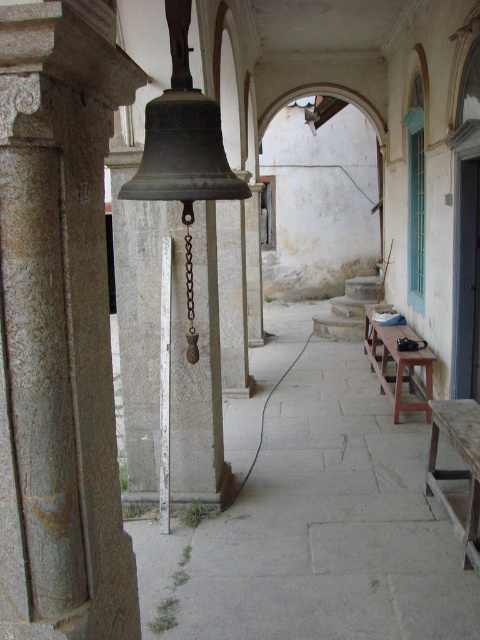
You are walking down the corridor and want to reach the end. There is a gray stone pillar at center and a smooth stone alley at center. Which one is closer to you as you walk forward?

The gray stone pillar at center is closer to you because it is in front of the smooth stone alley at center, meaning the alley is further back along the corridor.

You are planning to set up a temporary event in the corridor and need to know if the smooth stone alley at center can fit entirely within the space occupied by the wooden picnic table at center. Based on the scene description, can it?

The smooth stone alley at center occupies less space than the wooden picnic table at center, so yes, the smooth stone alley at center can fit entirely within the space occupied by the wooden picnic table at center.

You are a tour guide explaining the architecture of the corridor. Which object, the gray stone pillar at center or the smooth stone alley at center, would you mention as being much taller?

The gray stone pillar at center is much taller than the smooth stone alley at center.